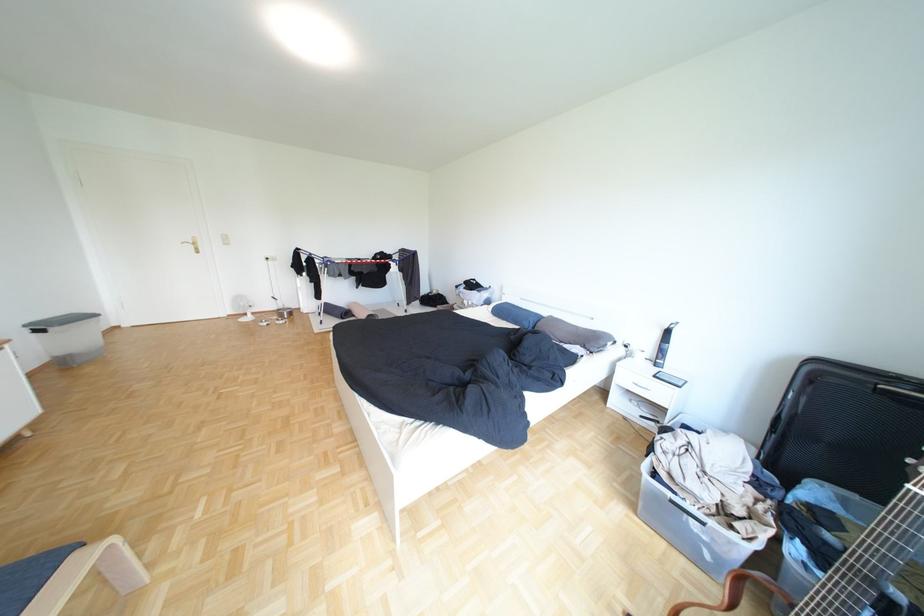
Locate an element on the screen. gold door handle is located at coordinates (191, 244).